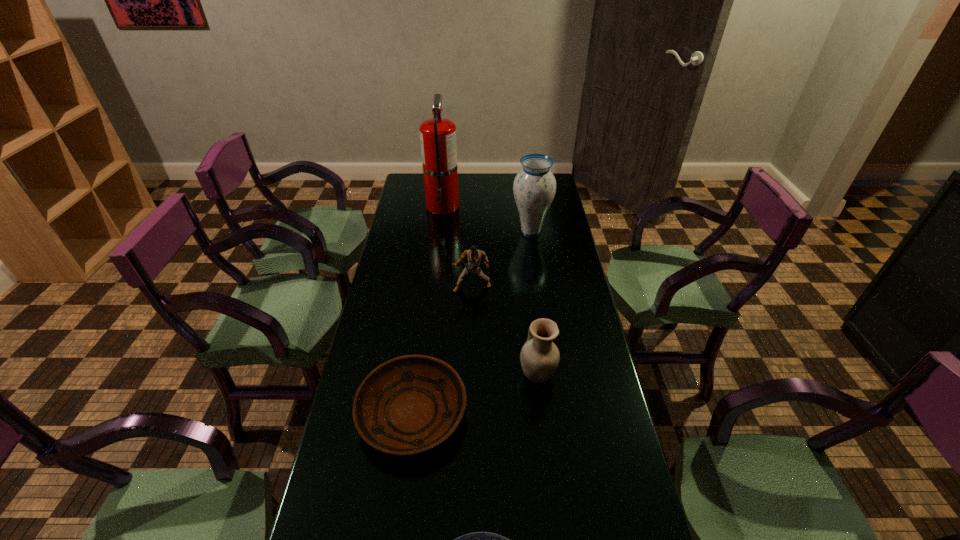
The height and width of the screenshot is (540, 960). Find the location of `fire extinguisher`. fire extinguisher is located at coordinates (438, 141).

Locate an element on the screen. This screenshot has width=960, height=540. the tallest object is located at coordinates (438, 141).

Where is `the fifth shortest object`? This screenshot has width=960, height=540. the fifth shortest object is located at coordinates (534, 187).

Identify the location of the second farthest object. The image size is (960, 540). (534, 187).

Locate an element on the screen. Image resolution: width=960 pixels, height=540 pixels. pottery is located at coordinates (539, 356).

In order to click on the fourth nearest object in this screenshot , I will do `click(474, 256)`.

The height and width of the screenshot is (540, 960). I want to click on the taller plate, so (410, 404).

Image resolution: width=960 pixels, height=540 pixels. In order to click on the fifth tallest object in this screenshot , I will do `click(410, 404)`.

Locate an element on the screen. blank area located 0.310m at the nozzle of the tallest object is located at coordinates 436,263.

I want to click on vacant position located 0.190m on the front of the vase, so click(537, 274).